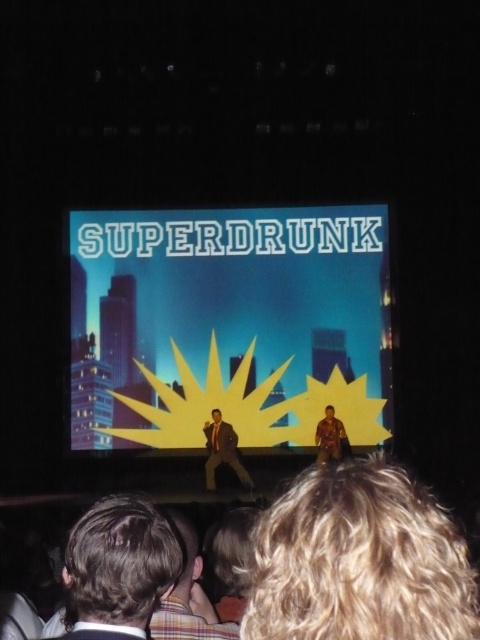
Question: Is blonde hair at lower center positioned at the back of matte black suit at center?

Choices:
 (A) no
 (B) yes

Answer: (A)

Question: Which point is farther to the camera?

Choices:
 (A) yellow paper at center
 (B) brown hair at lower left

Answer: (A)

Question: Which object appears farthest from the camera in this image?

Choices:
 (A) yellow paper at center
 (B) matte black suit at center

Answer: (A)

Question: Which object is farther from the camera taking this photo?

Choices:
 (A) blonde hair at lower center
 (B) yellow paper at center
 (C) camouflage-patterned shirt at center
 (D) matte black suit at center

Answer: (B)

Question: Where is yellow paper at center located in relation to blonde hair at lower center in the image?

Choices:
 (A) above
 (B) below

Answer: (A)

Question: Does yellow paper at center appear on the right side of camouflage-patterned shirt at center?

Choices:
 (A) yes
 (B) no

Answer: (B)